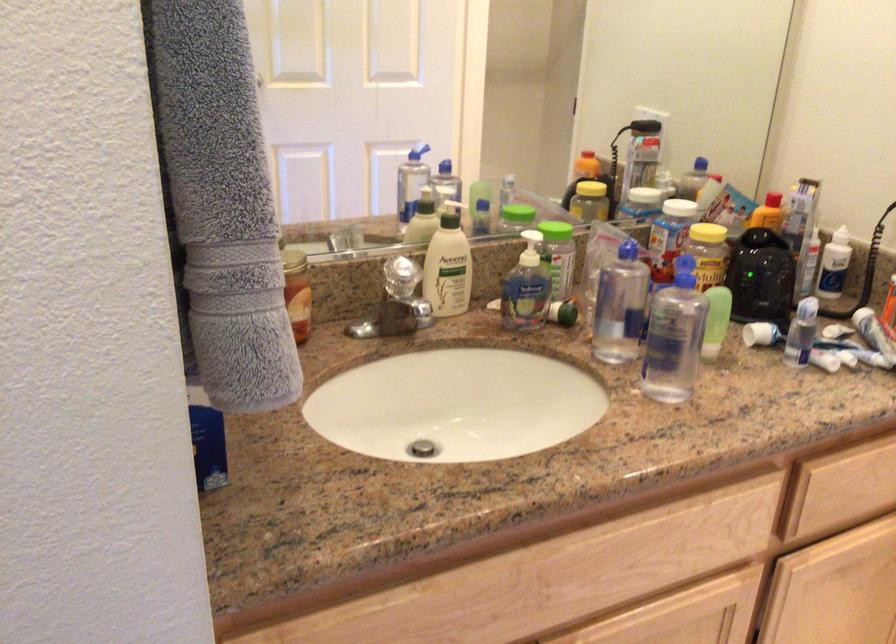
Where would you push the white lotion pump? Please return your answer as a coordinate pair (x, y).

(448, 265)